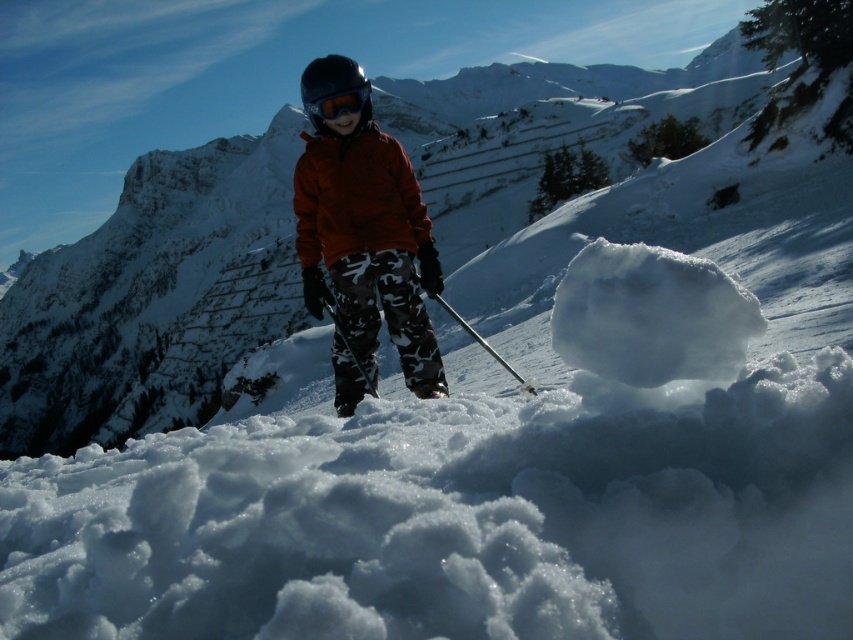
Question: Is orange softshell jacket at center in front of metallic ski pole at center?

Choices:
 (A) yes
 (B) no

Answer: (B)

Question: Among these objects, which one is farthest from the camera?

Choices:
 (A) matte red jacket at center
 (B) orange softshell jacket at center

Answer: (A)

Question: Estimate the real-world distances between objects in this image. Which object is farther from the metallic ski pole at center?

Choices:
 (A) matte red jacket at center
 (B) orange softshell jacket at center
 (C) matte black goggles at center

Answer: (C)

Question: From the image, what is the correct spatial relationship of matte red jacket at center in relation to matte black goggles at center?

Choices:
 (A) below
 (B) above

Answer: (A)

Question: Which object is positioned closest to the matte black goggles at center?

Choices:
 (A) metallic ski pole at center
 (B) matte red jacket at center
 (C) orange softshell jacket at center

Answer: (B)

Question: Is orange softshell jacket at center below matte black goggles at center?

Choices:
 (A) yes
 (B) no

Answer: (A)